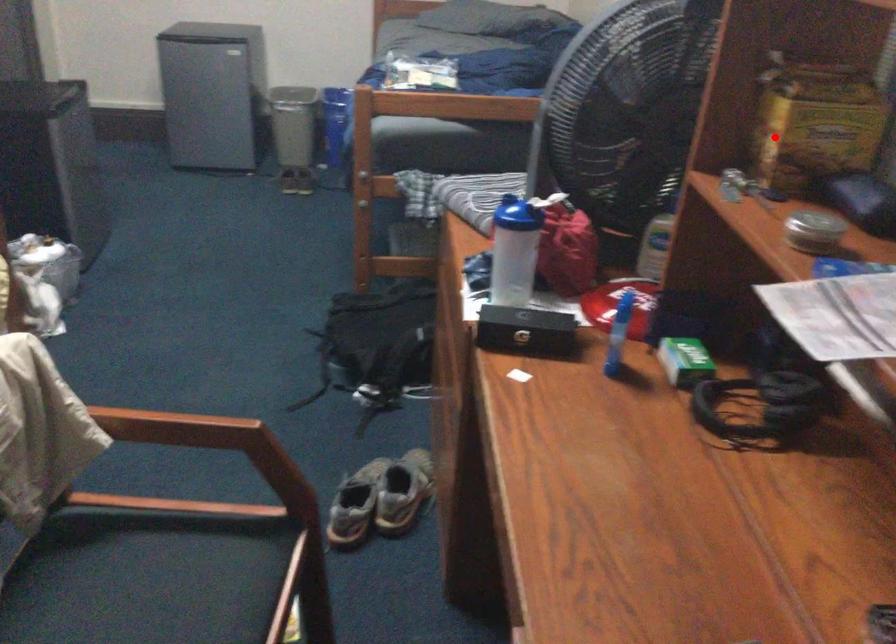
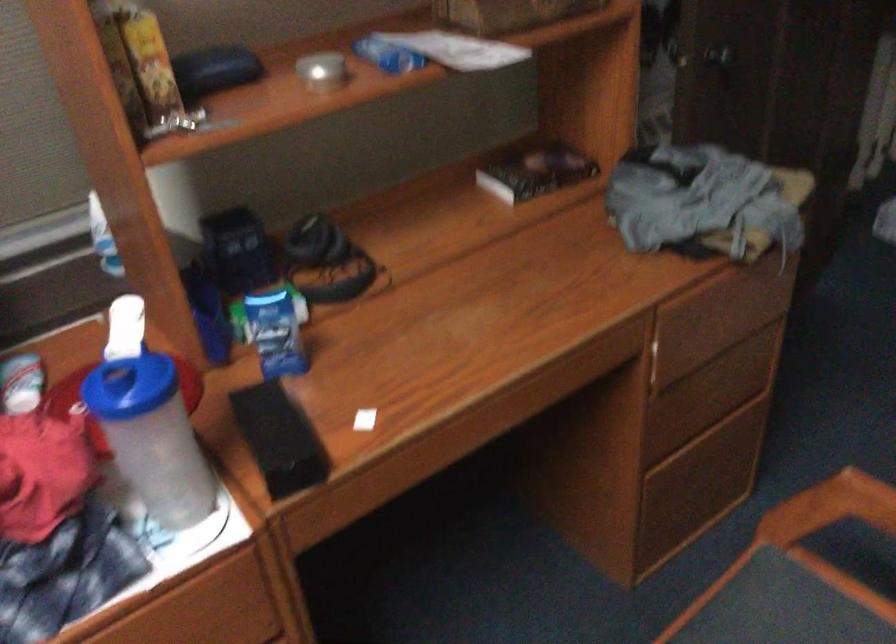
Question: I am providing you with two images of the same scene from different viewpoints. Given a red point in image1, look at the same physical point in image2. Is it:

Choices:
 (A) Closer to the viewpoint
 (B) Farther from the viewpoint

Answer: (A)